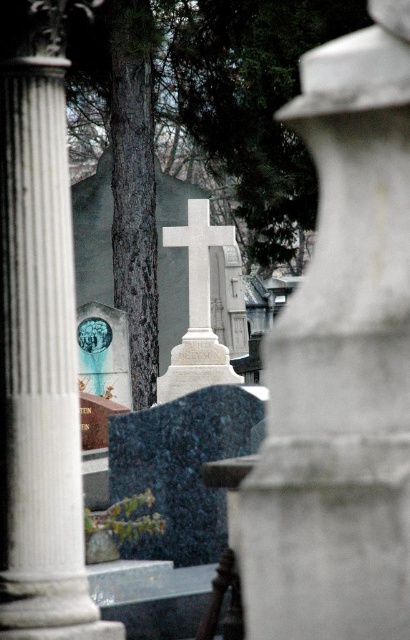
Question: From the image, what is the correct spatial relationship of white marble pillar at center in relation to white marble cross at center?

Choices:
 (A) right
 (B) left

Answer: (A)

Question: Does white marble pillar at center lie behind white marble column at left?

Choices:
 (A) no
 (B) yes

Answer: (A)

Question: Which object is farther from the camera taking this photo?

Choices:
 (A) white marble cross at center
 (B) white marble pillar at center
 (C) white marble column at left

Answer: (A)

Question: Which point appears farthest from the camera in this image?

Choices:
 (A) (407, 316)
 (B) (68, 442)
 (C) (186, 228)

Answer: (C)

Question: Is white marble pillar at center positioned in front of white marble cross at center?

Choices:
 (A) no
 (B) yes

Answer: (B)

Question: Which is nearer to the white marble cross at center?

Choices:
 (A) white marble column at left
 (B) white marble pillar at center

Answer: (B)